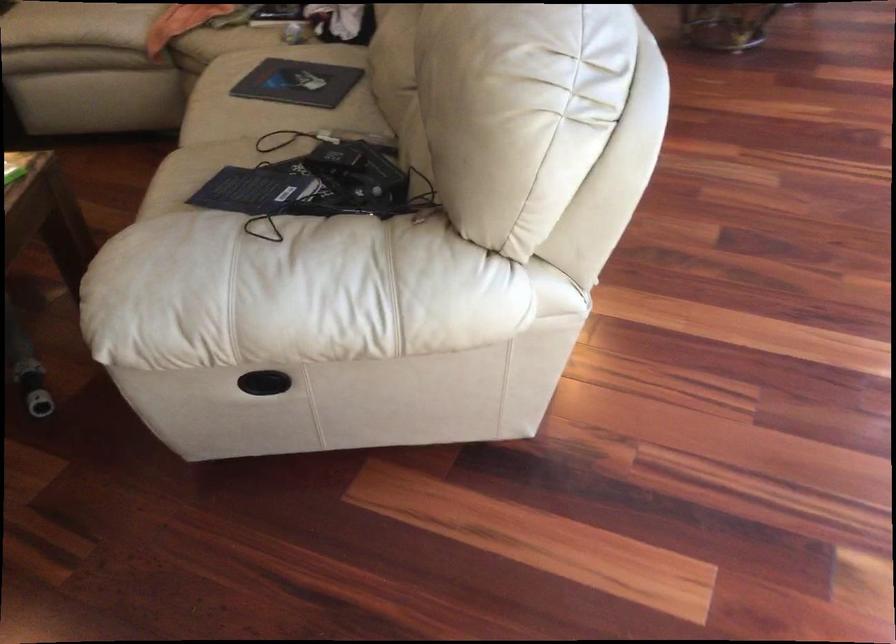
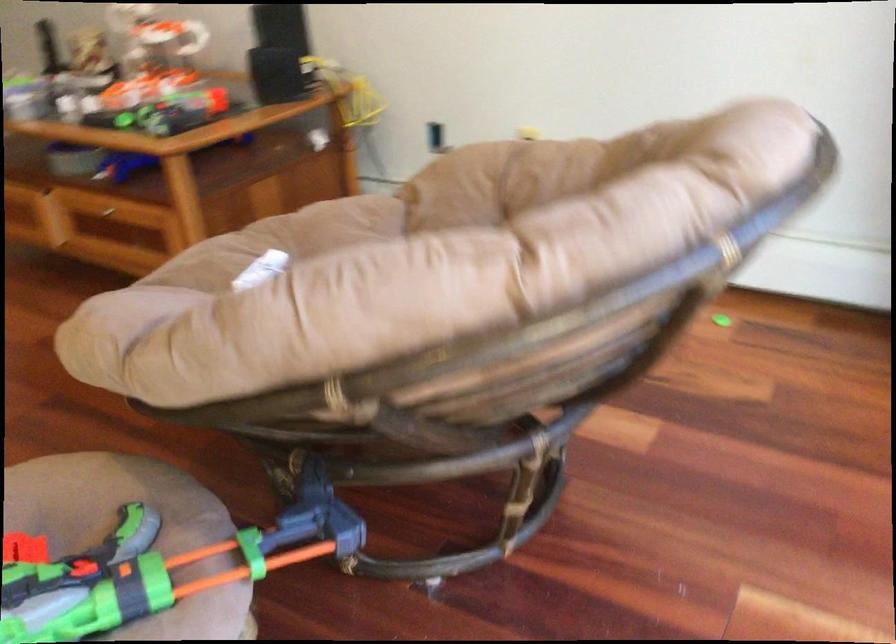
What movement of the cameraman would produce the second image?

The cameraman walked toward right, forward.